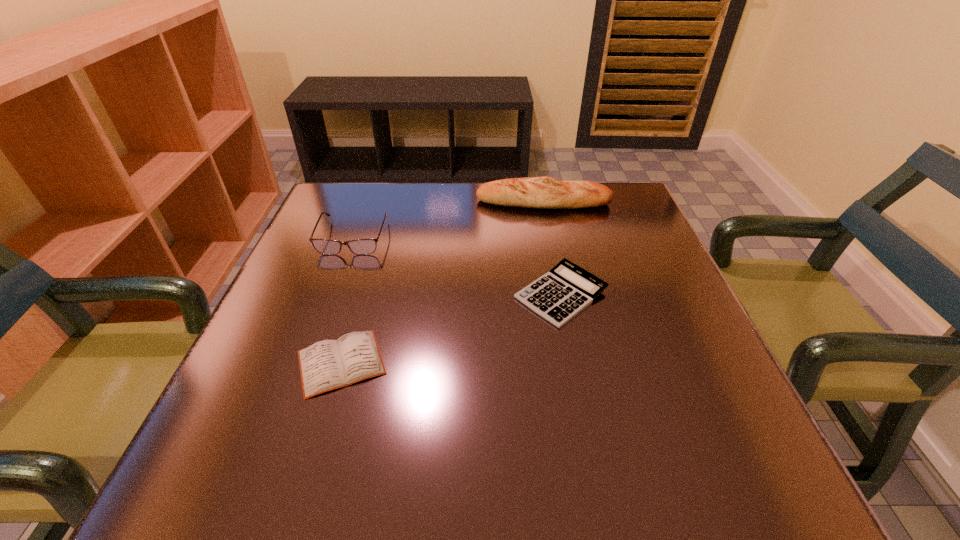
At what (x,y) coordinates should I click in order to perform the action: click on free point located 0.270m on the front of the calculator. Please return your answer as a coordinate pair (x, y). The width and height of the screenshot is (960, 540). Looking at the image, I should click on tap(597, 475).

Where is `free region located on the right of the shortest object`? The image size is (960, 540). free region located on the right of the shortest object is located at coordinates (494, 362).

The width and height of the screenshot is (960, 540). I want to click on baguet that is positioned at the far edge, so click(x=545, y=192).

Identify the location of spectacles that is at the far edge. The height and width of the screenshot is (540, 960). pos(323,246).

The image size is (960, 540). I want to click on spectacles present at the left edge, so click(323, 246).

At what (x,y) coordinates should I click in order to perform the action: click on diary at the left edge. Please return your answer as a coordinate pair (x, y). The width and height of the screenshot is (960, 540). Looking at the image, I should click on (326, 365).

Find the location of `baguet that is at the right edge`. baguet that is at the right edge is located at coordinates (545, 192).

Image resolution: width=960 pixels, height=540 pixels. Find the location of `calculator that is at the right edge`. calculator that is at the right edge is located at coordinates (560, 294).

At what (x,y) coordinates should I click in order to perform the action: click on object present at the far left corner. Please return your answer as a coordinate pair (x, y). Looking at the image, I should click on (323, 246).

Where is `object that is at the far right corner`? This screenshot has height=540, width=960. object that is at the far right corner is located at coordinates 545,192.